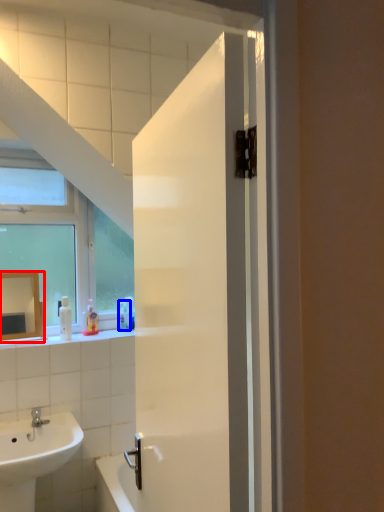
Question: Which object appears farthest to the camera in this image, mirror (highlighted by a red box) or toiletry (highlighted by a blue box)?

Choices:
 (A) mirror
 (B) toiletry

Answer: (B)